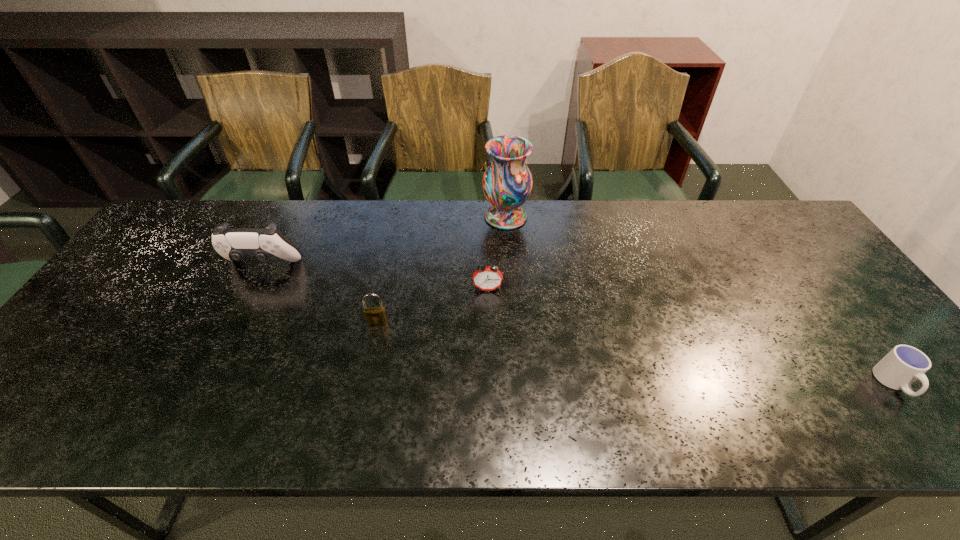
At what (x,y) coordinates should I click in order to perform the action: click on the farthest object. Please return your answer as a coordinate pair (x, y). Looking at the image, I should click on (507, 182).

The width and height of the screenshot is (960, 540). Find the location of `the tallest object`. the tallest object is located at coordinates (507, 182).

The image size is (960, 540). I want to click on control, so click(x=235, y=244).

You are a GUI agent. You are given a task and a screenshot of the screen. Output one action in this format:
    pyautogui.click(x=<x>, y=<y>)
    Task: Click on the leftmost object
    The image size is (960, 540).
    Given the screenshot: What is the action you would take?
    pyautogui.click(x=235, y=244)

This screenshot has height=540, width=960. Find the location of `the fourth object from right to left`. the fourth object from right to left is located at coordinates (374, 316).

Image resolution: width=960 pixels, height=540 pixels. I want to click on padlock, so click(374, 316).

Locate an element on the screen. The height and width of the screenshot is (540, 960). the third farthest object is located at coordinates (487, 278).

What are the coordinates of `the rightmost object` in the screenshot? It's located at (904, 364).

In order to click on cup in this screenshot , I will do `click(904, 364)`.

Find the location of a particular element. free spot located 0.350m on the left of the farthest object is located at coordinates (374, 217).